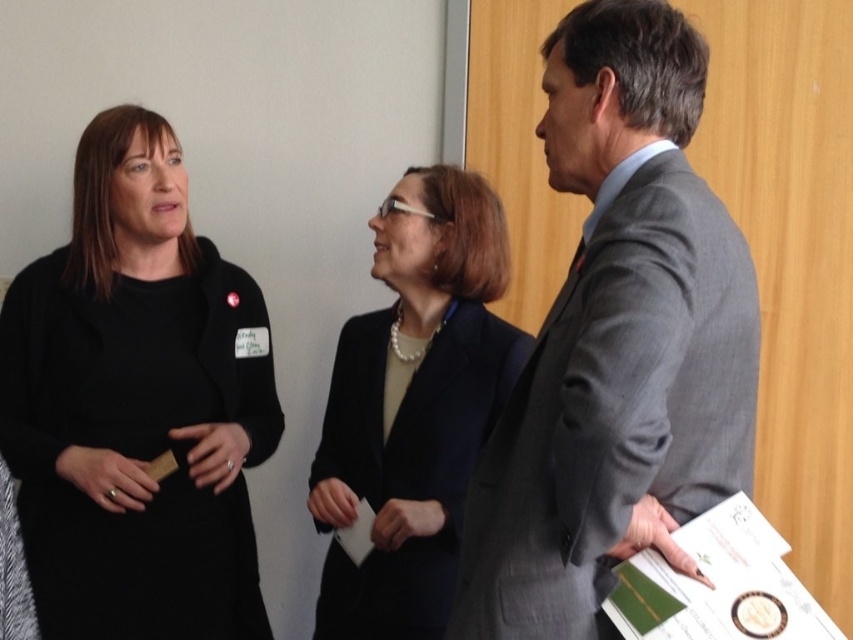
What do you see at coordinates (616, 342) in the screenshot? This screenshot has height=640, width=853. I see `gray suit at center` at bounding box center [616, 342].

Where is `gray suit at center`? The image size is (853, 640). gray suit at center is located at coordinates (616, 342).

Identify the location of gray suit at center. Image resolution: width=853 pixels, height=640 pixels. (616, 342).

Does gray suit at center have a greater height compared to black matte dress at left?

Incorrect, gray suit at center's height is not larger of black matte dress at left's.

Which is behind, point (669, 554) or point (219, 310)?

The point (219, 310) is more distant.

Find the location of `gray suit at center`. gray suit at center is located at coordinates (616, 342).

Can you confirm if black matte dress at left is wider than matte black blazer at center?

Correct, the width of black matte dress at left exceeds that of matte black blazer at center.

Between black matte dress at left and matte black blazer at center, which one has less height?

matte black blazer at center is shorter.

This screenshot has width=853, height=640. Find the location of `black matte dress at left`. black matte dress at left is located at coordinates (136, 404).